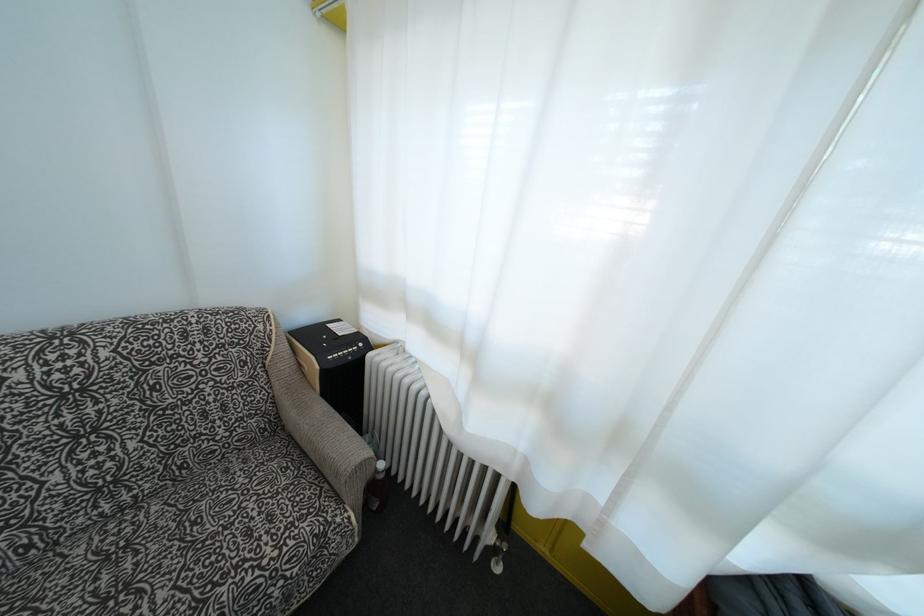
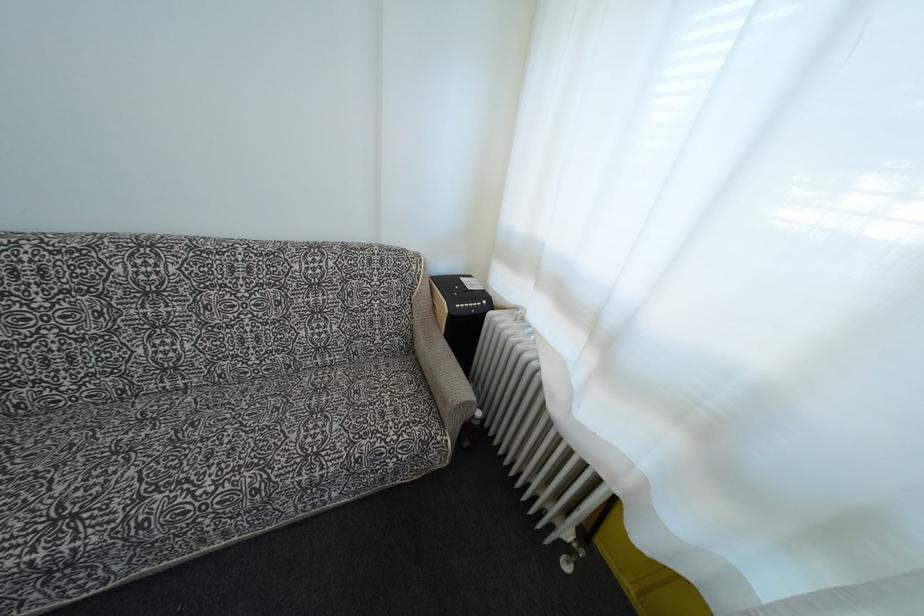
The point at [385,483] is marked in the first image. Where is the corresponding point in the second image?

(480, 429)